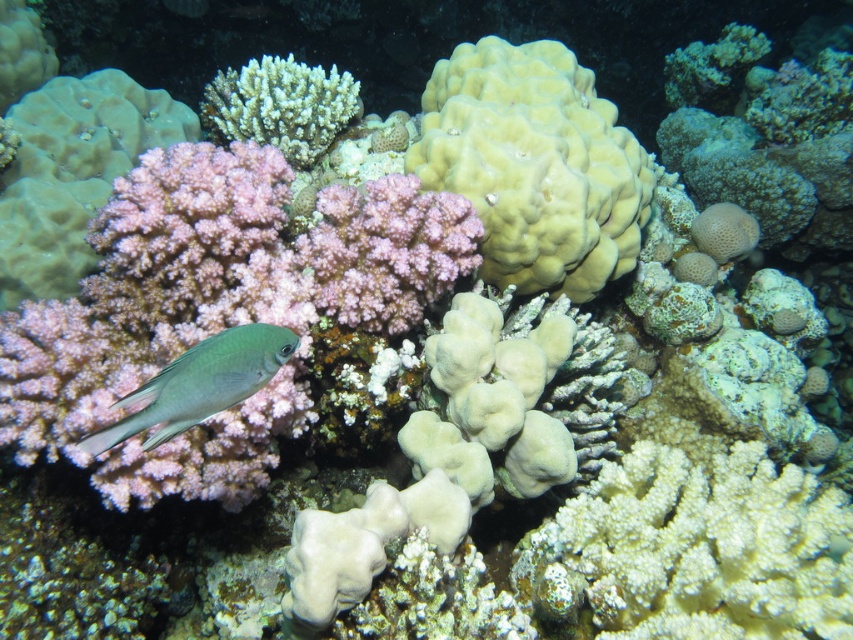
Consider the image. Does yellow matte coral at center have a lesser height compared to white coral at upper center?

Incorrect, yellow matte coral at center's height does not fall short of white coral at upper center's.

Is yellow matte coral at center smaller than white coral at upper center?

Actually, yellow matte coral at center might be larger than white coral at upper center.

Is point (583, 141) farther from camera compared to point (318, 144)?

No.

Identify the location of yellow matte coral at center. This screenshot has width=853, height=640. (535, 164).

Can you confirm if yellow matte coral at center is positioned above green matte fish at lower left?

Correct, yellow matte coral at center is located above green matte fish at lower left.

Can you confirm if yellow matte coral at center is taller than green matte fish at lower left?

Yes, yellow matte coral at center is taller than green matte fish at lower left.

Which is in front, point (512, 65) or point (190, 396)?

Point (190, 396)

At what (x,y) coordinates should I click in order to perform the action: click on yellow matte coral at center. Please return your answer as a coordinate pair (x, y). The height and width of the screenshot is (640, 853). Looking at the image, I should click on (535, 164).

Is point (341, 88) farther from viewer compared to point (219, 348)?

Yes, it is.

Which is above, white coral at upper center or green matte fish at lower left?

white coral at upper center is higher up.

Locate an element on the screen. white coral at upper center is located at coordinates (281, 106).